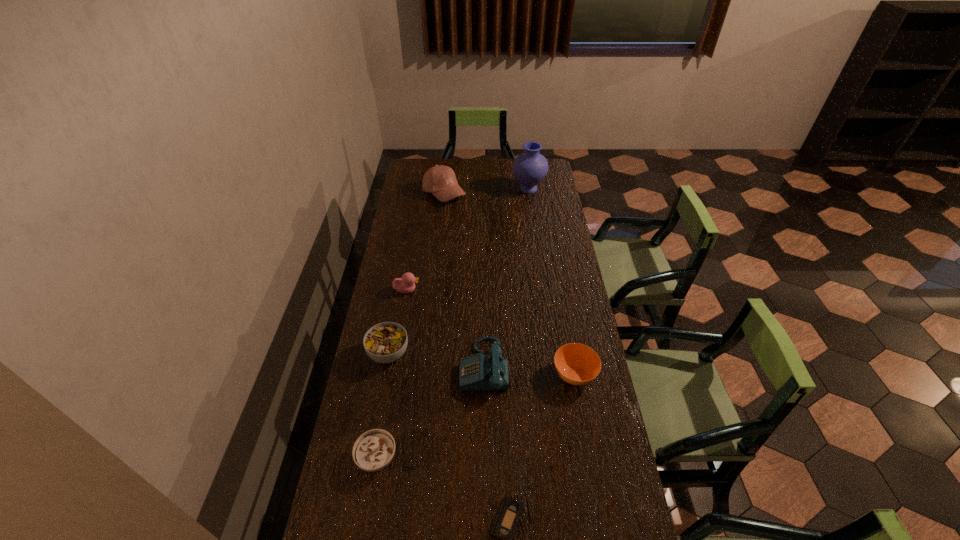
Find the location of a particular element. The width and height of the screenshot is (960, 540). free space located 0.160m on the dial of the telephone is located at coordinates (414, 366).

At what (x,y) coordinates should I click in order to perform the action: click on vacant region located 0.300m on the dial of the telephone. Please return your answer as a coordinate pair (x, y). This screenshot has height=540, width=960. Looking at the image, I should click on (373, 366).

The height and width of the screenshot is (540, 960). What are the coordinates of `vacant area located 0.140m on the dial of the telephone` in the screenshot? It's located at (420, 366).

Find the location of a particular element. The image size is (960, 540). vacant space located 0.080m on the front of the rightmost soup bowl is located at coordinates (582, 417).

At what (x,y) coordinates should I click in order to perform the action: click on vacant space located 0.100m on the right of the second nearest object. Please return your answer as a coordinate pair (x, y). The height and width of the screenshot is (540, 960). Looking at the image, I should click on (431, 457).

Where is `vase at the far edge`? This screenshot has height=540, width=960. vase at the far edge is located at coordinates (530, 168).

I want to click on baseball cap that is at the far edge, so click(x=440, y=180).

At what (x,y) coordinates should I click in order to perform the action: click on baseball cap that is at the left edge. Please return your answer as a coordinate pair (x, y). This screenshot has height=540, width=960. Looking at the image, I should click on point(440,180).

In order to click on duckling that is at the left edge in this screenshot , I will do 406,284.

Identify the location of vase that is at the right edge. This screenshot has height=540, width=960. (530, 168).